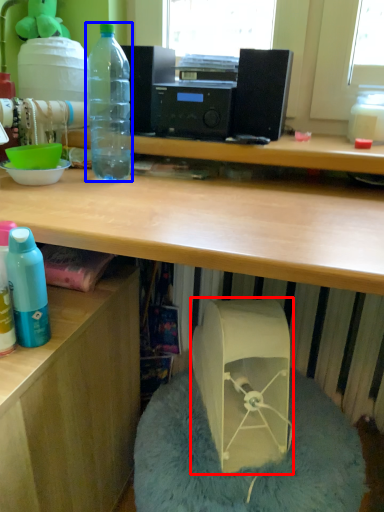
Question: Which point is closer to the camera, wide (highlighted by a red box) or bottle (highlighted by a blue box)?

Choices:
 (A) wide
 (B) bottle

Answer: (A)